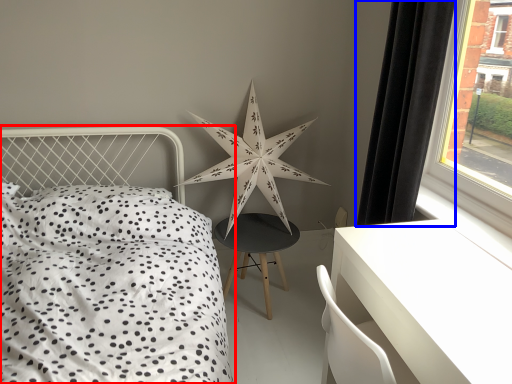
Question: Which object is closer to the camera taking this photo, bed (highlighted by a red box) or curtain (highlighted by a blue box)?

Choices:
 (A) bed
 (B) curtain

Answer: (A)